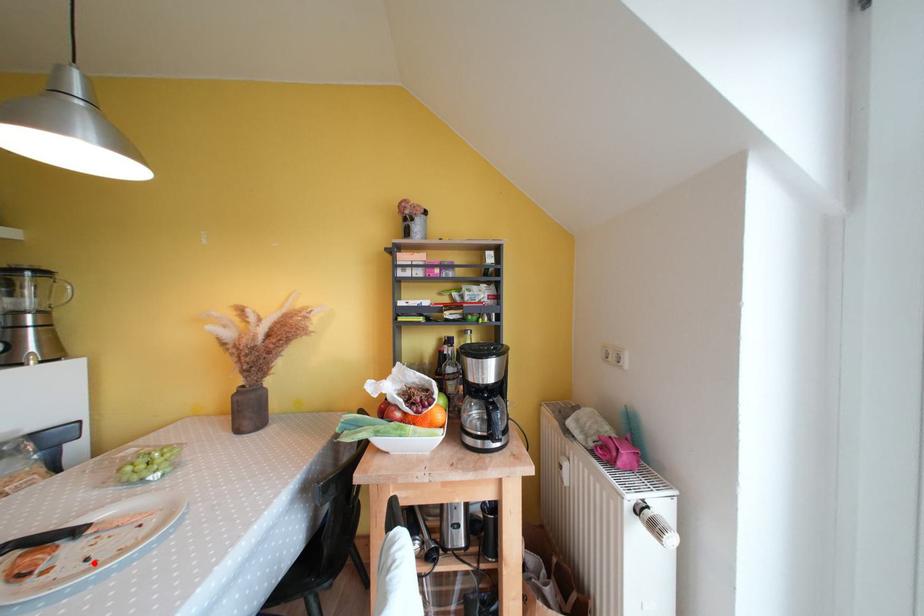
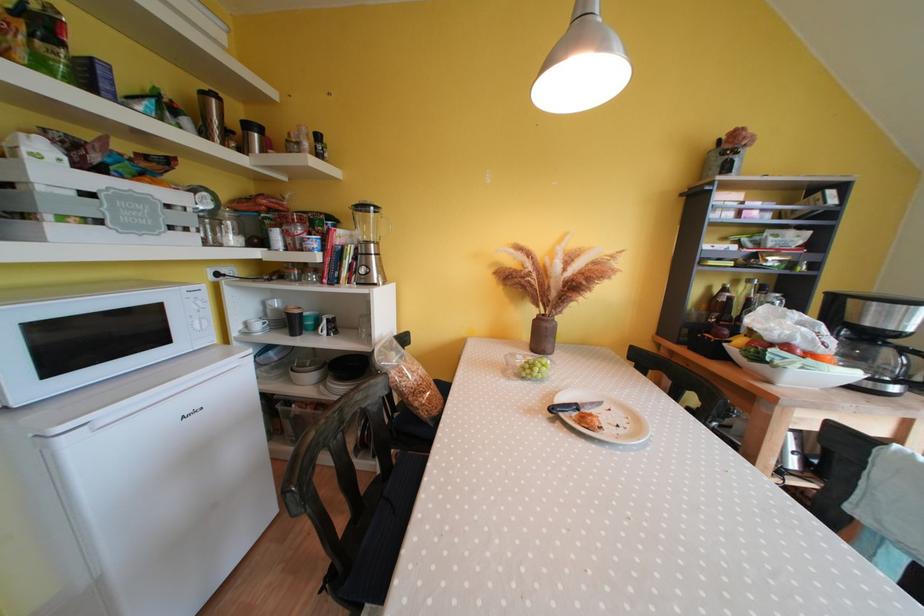
Locate, in the second image, the point that corresponds to the highlighted location in the first image.

(624, 430)